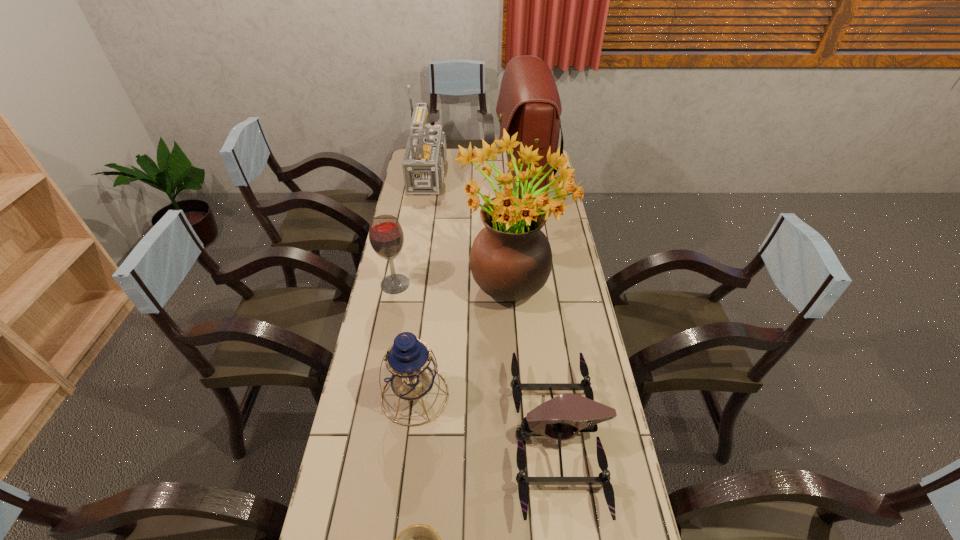
The image size is (960, 540). I want to click on free spot located 0.210m on the front-facing side of the radio receiver, so click(x=501, y=174).

Where is `free region located 0.240m on the back of the alcohol`? This screenshot has height=540, width=960. free region located 0.240m on the back of the alcohol is located at coordinates (405, 234).

Where is `vacant space situated 0.100m on the front-facing side of the lantern`? vacant space situated 0.100m on the front-facing side of the lantern is located at coordinates [407, 463].

Locate an element on the screen. Image resolution: width=960 pixels, height=540 pixels. vacant space located on the front-facing side of the second shortest object is located at coordinates (479, 437).

The image size is (960, 540). In order to click on vacant area located 0.130m on the front-facing side of the second shortest object in this screenshot , I will do `click(464, 437)`.

In order to click on free space located on the front-facing side of the second shortest object in this screenshot , I will do `click(449, 437)`.

Where is `satchel that is at the far edge`? The width and height of the screenshot is (960, 540). satchel that is at the far edge is located at coordinates (528, 103).

You are a GUI agent. You are given a task and a screenshot of the screen. Output one action in this format:
    pyautogui.click(x=<x>, y=<y>)
    Task: Click on the radio receiver at the far edge
    The width and height of the screenshot is (960, 540).
    Given the screenshot: What is the action you would take?
    pyautogui.click(x=423, y=164)

This screenshot has width=960, height=540. I want to click on radio receiver located at the left edge, so click(x=423, y=164).

Identify the location of alcohol present at the left edge. The image size is (960, 540). (386, 236).